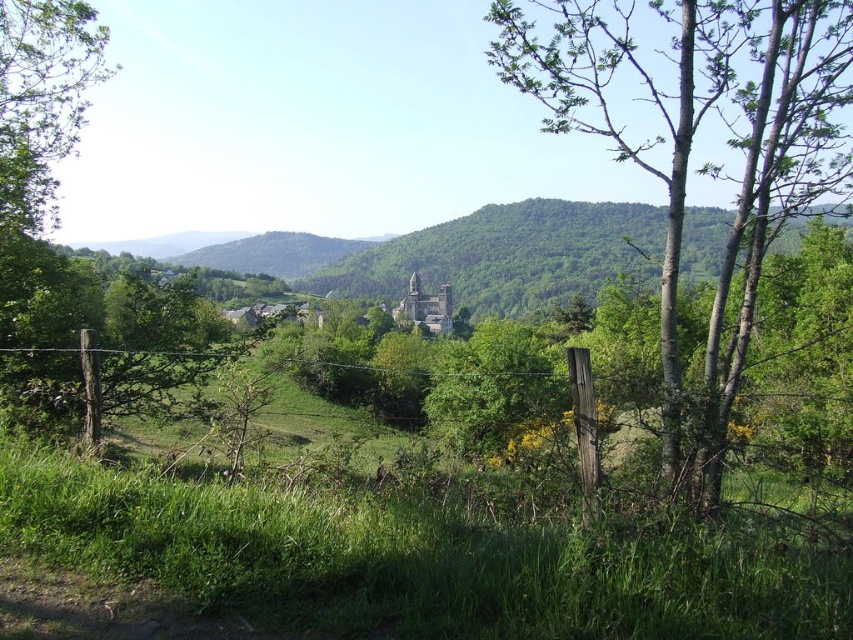
You are standing in the rural landscape scene and want to place a small flag at each of the two points, point (572, 51) and point (567, 214). Which point will have its flag appear higher in the photo?

Point (572, 51) is closer to the camera than point (567, 214), so the flag placed at point (572, 51) will appear higher in the photo.

You are an outdoor enthusiast planning a hiking route through the rural landscape. You want to reach the distant castle or church visible in the background. Which object, the green bark tree at center or the green forested mountain at center, would you encounter first along your path?

You would encounter the green bark tree at center first because it is in front of the green forested mountain at center, making it closer to your starting point.

Based on the photo, you are standing in the rural landscape scene. You see a point marked at coordinate (689, 145). What object is located at this point?

The point at coordinate (689, 145) marks the green bark tree at center.